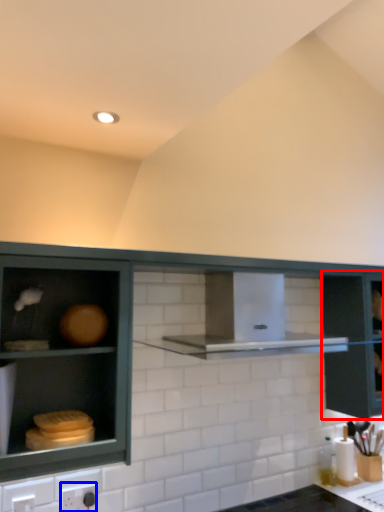
Question: Which object appears farthest to the camera in this image, glass door (highlighted by a red box) or electric outlet (highlighted by a blue box)?

Choices:
 (A) glass door
 (B) electric outlet

Answer: (A)